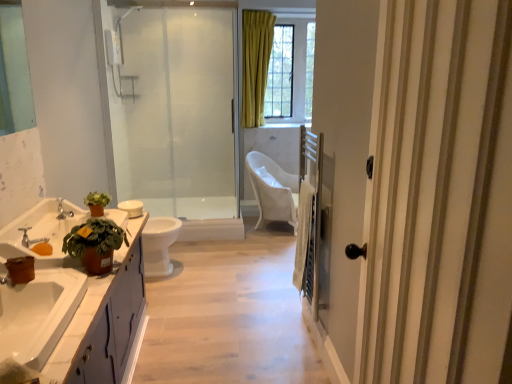
The image size is (512, 384). Find the location of `vacant region in front of woven white chair at center`. vacant region in front of woven white chair at center is located at coordinates (259, 245).